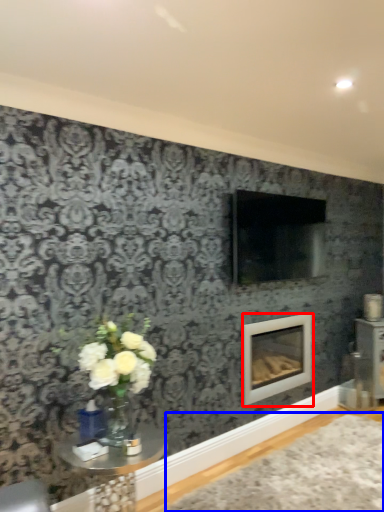
Question: Which object is closer to the camera taking this photo, fireplace (highlighted by a red box) or plain (highlighted by a blue box)?

Choices:
 (A) fireplace
 (B) plain

Answer: (B)